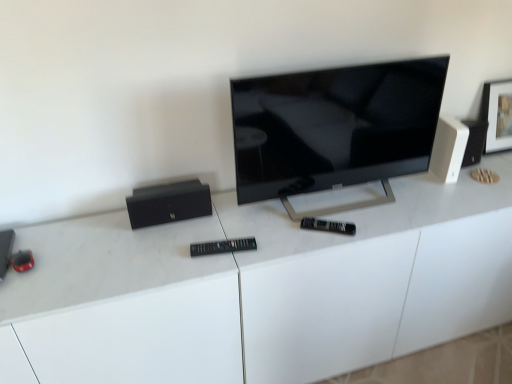
Where is `free space in front of white plastic speaker at upper right, the first speaker in the top-to-bottom sequence`? The width and height of the screenshot is (512, 384). free space in front of white plastic speaker at upper right, the first speaker in the top-to-bottom sequence is located at coordinates (451, 203).